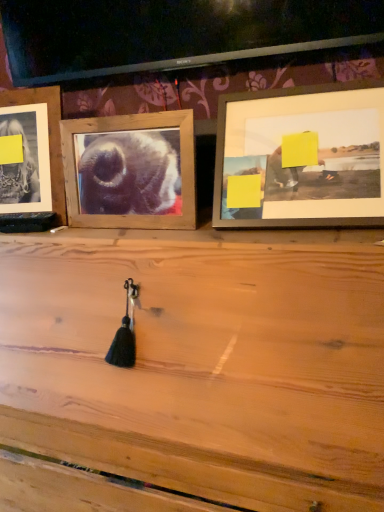
Question: Is wooden picture frame at upper right, which appears as the first picture frame when viewed from the right, positioned far away from wooden frame at center, placed as the 2th picture frame when sorted from right to left?

Choices:
 (A) yes
 (B) no

Answer: (B)

Question: Can you confirm if wooden picture frame at upper right, which appears as the first picture frame when viewed from the right, is bigger than wooden frame at center, the second picture frame from the left?

Choices:
 (A) no
 (B) yes

Answer: (B)

Question: Considering the relative sizes of wooden picture frame at upper right, which appears as the first picture frame when viewed from the right, and wooden frame at center, the second picture frame from the left, in the image provided, is wooden picture frame at upper right, which appears as the first picture frame when viewed from the right, taller than wooden frame at center, the second picture frame from the left,?

Choices:
 (A) yes
 (B) no

Answer: (A)

Question: Is wooden frame at center, placed as the 2th picture frame when sorted from right to left, at the back of wooden picture frame at upper right, which appears as the first picture frame when viewed from the right?

Choices:
 (A) yes
 (B) no

Answer: (B)

Question: Is wooden picture frame at upper right, which appears as the first picture frame when viewed from the right, to the right of wooden frame at center, the second picture frame from the left, from the viewer's perspective?

Choices:
 (A) yes
 (B) no

Answer: (A)

Question: Considering the positions of wooden frame at center, the second picture frame from the left, and wooden picture frame at upper right, which appears as the first picture frame when viewed from the right, in the image, is wooden frame at center, the second picture frame from the left, bigger or smaller than wooden picture frame at upper right, which appears as the first picture frame when viewed from the right,?

Choices:
 (A) small
 (B) big

Answer: (A)

Question: Considering the positions of point (170, 170) and point (284, 120), is point (170, 170) closer or farther from the camera than point (284, 120)?

Choices:
 (A) closer
 (B) farther

Answer: (B)

Question: From the image's perspective, relative to wooden picture frame at upper right, the third picture frame when ordered from left to right, is wooden frame at center, the second picture frame from the left, above or below?

Choices:
 (A) above
 (B) below

Answer: (B)

Question: From a real-world perspective, relative to wooden picture frame at upper right, which appears as the first picture frame when viewed from the right, is wooden frame at center, placed as the 2th picture frame when sorted from right to left, vertically above or below?

Choices:
 (A) below
 (B) above

Answer: (A)

Question: In terms of width, does wooden frame at left, the third picture frame in the right-to-left sequence, look wider or thinner when compared to wooden frame at center, the second picture frame from the left?

Choices:
 (A) thin
 (B) wide

Answer: (B)

Question: From their relative heights in the image, would you say wooden frame at left, the third picture frame in the right-to-left sequence, is taller or shorter than wooden frame at center, placed as the 2th picture frame when sorted from right to left?

Choices:
 (A) short
 (B) tall

Answer: (B)

Question: Is wooden frame at left, the third picture frame in the right-to-left sequence, in front of or behind wooden frame at center, placed as the 2th picture frame when sorted from right to left, in the image?

Choices:
 (A) behind
 (B) front

Answer: (A)

Question: From a real-world perspective, relative to wooden frame at center, placed as the 2th picture frame when sorted from right to left, is wooden frame at left, the third picture frame in the right-to-left sequence, vertically above or below?

Choices:
 (A) below
 (B) above

Answer: (B)

Question: Considering the positions of wooden frame at left, the third picture frame in the right-to-left sequence, and wooden picture frame at upper right, the third picture frame when ordered from left to right, in the image, is wooden frame at left, the third picture frame in the right-to-left sequence, taller or shorter than wooden picture frame at upper right, the third picture frame when ordered from left to right,?

Choices:
 (A) short
 (B) tall

Answer: (B)

Question: From the image's perspective, is wooden frame at left, the 1th picture frame in the left-to-right sequence, located above or below wooden picture frame at upper right, the third picture frame when ordered from left to right?

Choices:
 (A) below
 (B) above

Answer: (B)